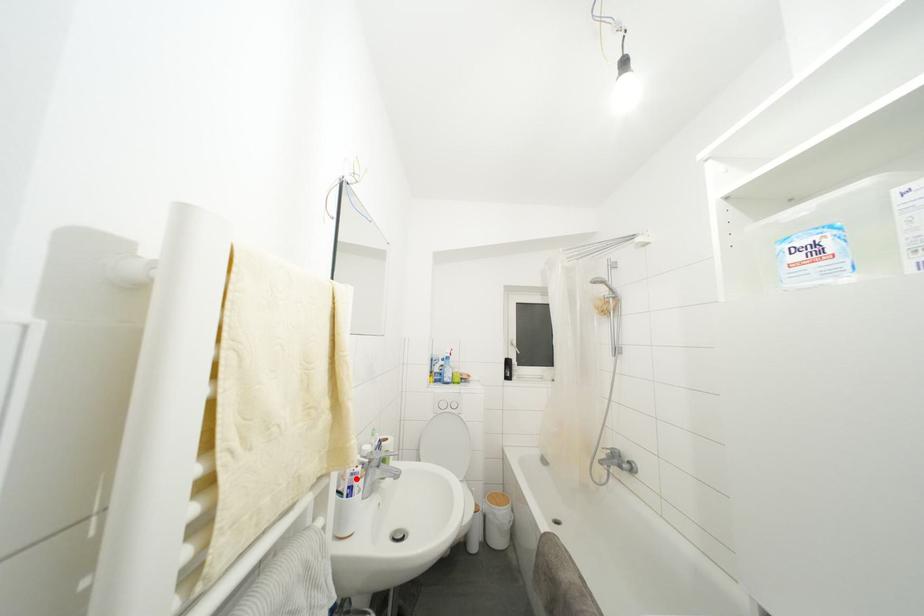
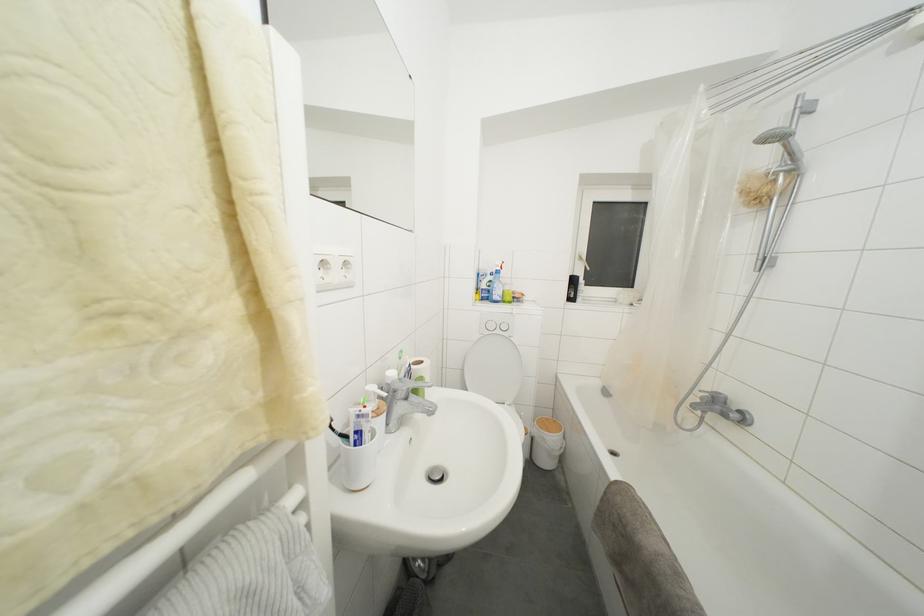
The point at the highlighted location is marked in the first image. Where is the corresponding point in the second image?

(362, 421)